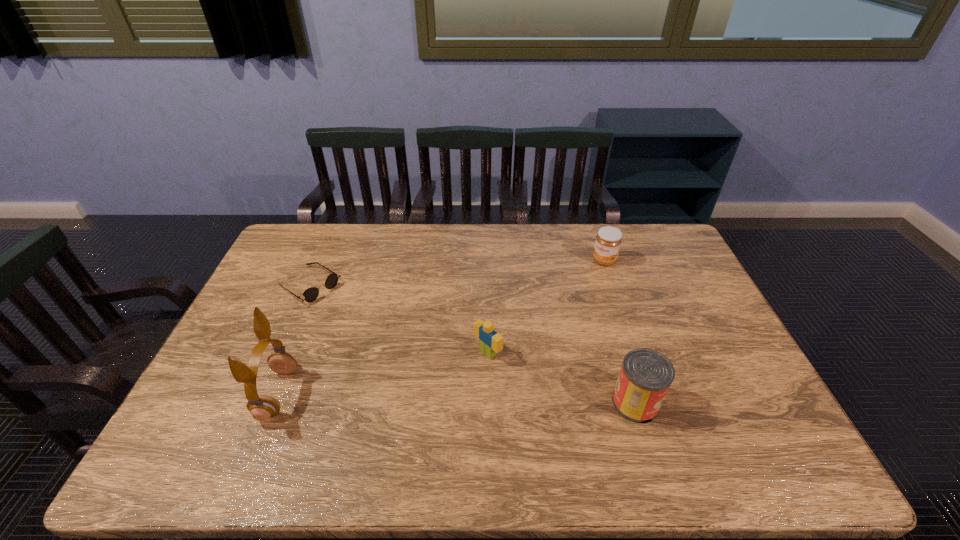
Where is `vacant space that satisfies the following two spatial constraints: 1. on the front side of the can; 2. on the right side of the shortest object`? Image resolution: width=960 pixels, height=540 pixels. vacant space that satisfies the following two spatial constraints: 1. on the front side of the can; 2. on the right side of the shortest object is located at coordinates (258, 403).

The width and height of the screenshot is (960, 540). I want to click on free region that satisfies the following two spatial constraints: 1. on the front side of the third object from left to right; 2. on the right side of the shortest object, so click(279, 353).

Identify the location of free location that satisfies the following two spatial constraints: 1. on the front side of the shortest object; 2. on the right side of the can. This screenshot has height=540, width=960. (258, 403).